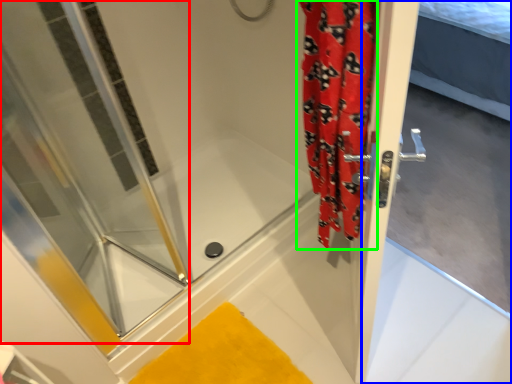
Question: Which object is positioned closest to shower door (highlighted by a red box)? Select from screen door (highlighted by a blue box) and shower curtain (highlighted by a green box).

Choices:
 (A) screen door
 (B) shower curtain

Answer: (B)